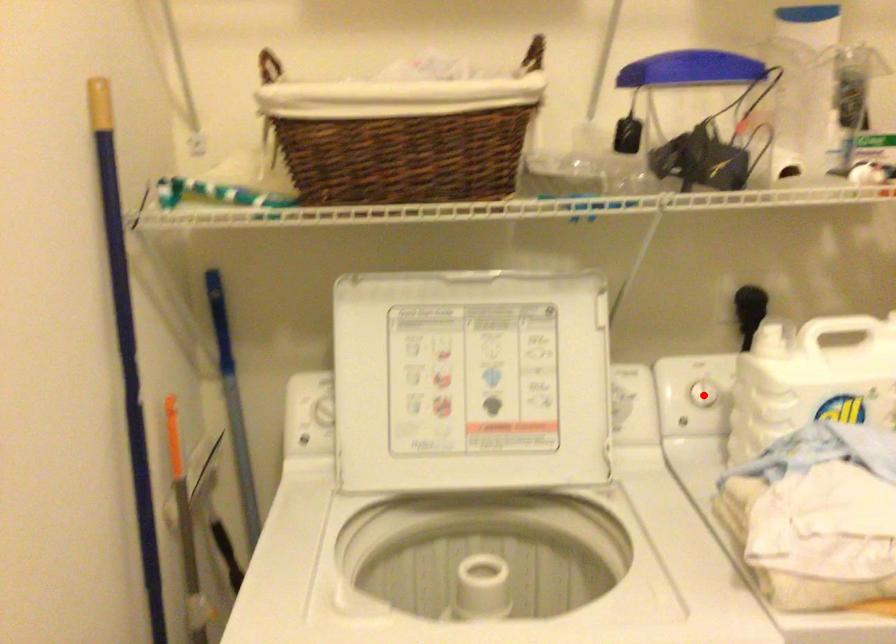
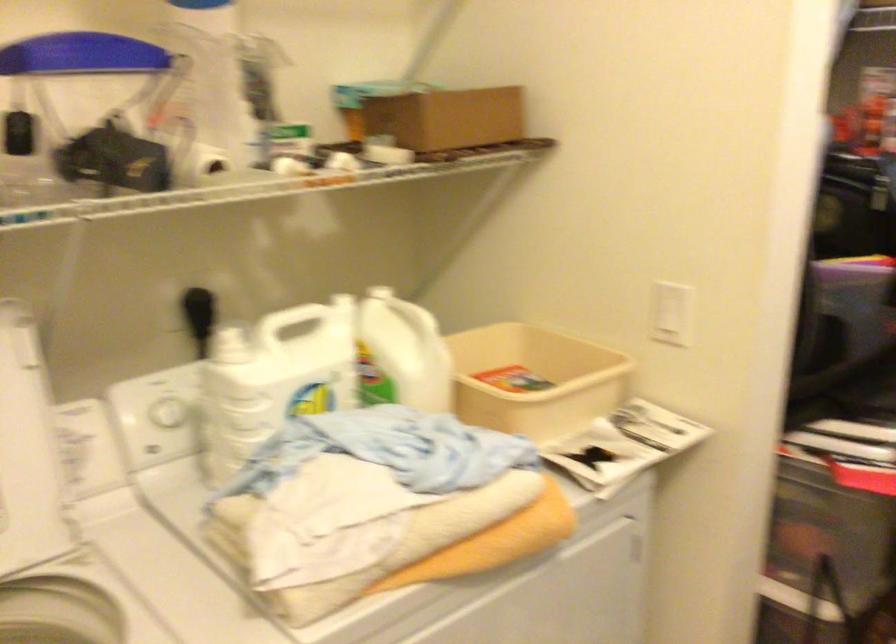
Question: I am providing you with two images of the same scene from different viewpoints. Image1 has a red point marked. In image2, the corresponding 3D location appears at what relative position? Reply with the corresponding letter.

Choices:
 (A) Closer
 (B) Farther

Answer: (A)